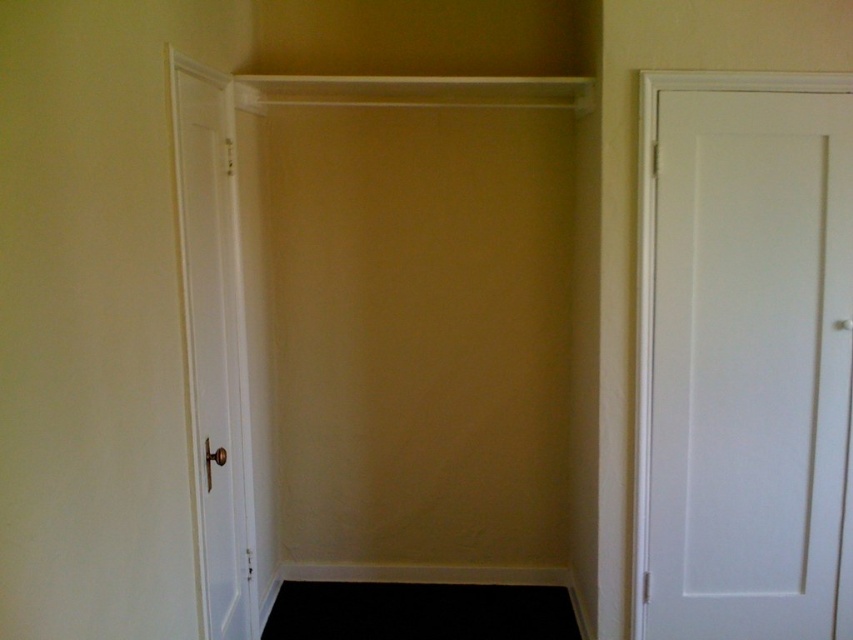
You are a delivery person trying to deliver a large package that is 5 feet long. You need to pass through the space between the white smooth door at right and white smooth door at left in the closet. Can the package fit through the space between them?

The white smooth door at right and white smooth door at left are 5.41 feet apart from each other. Since the package is 5 feet long, it can fit through the space between them as the distance is greater than the package length.

You are standing in front of the open closet and see the white smooth door at right and the white smooth door at left. Which door is closer to you?

The white smooth door at right is closer to you because the white smooth door at left is behind it.